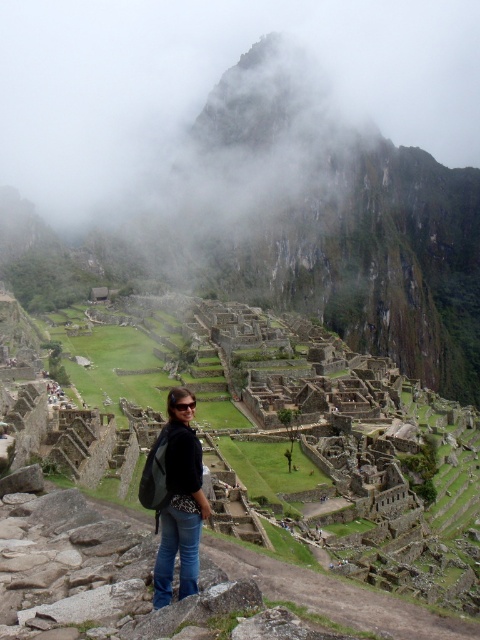
Question: Among these points, which one is nearest to the camera?

Choices:
 (A) (328, 68)
 (B) (166, 596)

Answer: (B)

Question: Which point is closer to the camera taking this photo?

Choices:
 (A) (155, 449)
 (B) (184, 108)

Answer: (A)

Question: In this image, where is foggy misty mountain peak at upper center located relative to denim jeans at center?

Choices:
 (A) above
 (B) below

Answer: (A)

Question: Can you confirm if foggy misty mountain peak at upper center is positioned to the right of denim jeans at center?

Choices:
 (A) yes
 (B) no

Answer: (A)

Question: Can you confirm if foggy misty mountain peak at upper center is thinner than denim jeans at center?

Choices:
 (A) no
 (B) yes

Answer: (A)